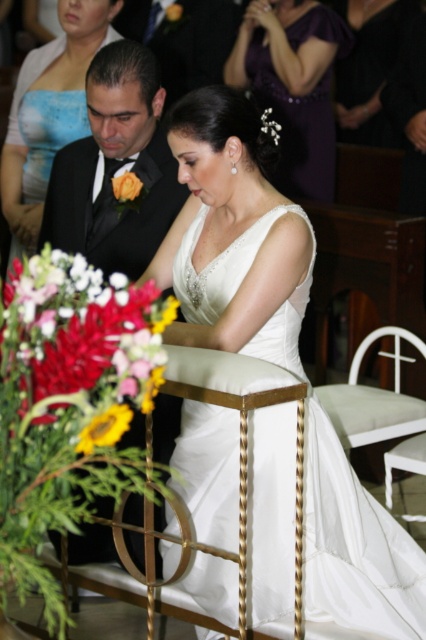
You are a photographer positioned behind the couple and want to capture a closeup shot of both the yellow matte sunflower at lower left and the white matte flower at upper center in the same frame. Given that your camera has a maximum focus range of 3.5 feet, will you be able to achieve this shot?

The distance between the yellow matte sunflower at lower left and the white matte flower at upper center is 3.79 feet, which exceeds the camera maximum focus range of 3.5 feet. Therefore, you cannot capture both in the same closeup shot.

You are a photographer at the wedding ceremony. You need to position yourself so that both the yellow matte sunflower at lower left and the white matte flower at upper center are visible in your shot. Based on their positions, where should you stand relative to the flowers?

You should position yourself below the white matte flower at upper center and above the yellow matte sunflower at lower left to capture both in your shot since the yellow matte sunflower at lower left is located below the white matte flower at upper center.

You are a photographer at a fashion show. You need to decide which dress to feature in the next photo. The satin purple dress at upper center and the matte black dress at center are both in the frame. Based on their sizes, which dress should you focus on to ensure it stands out more?

The satin purple dress at upper center is wider than the matte black dress at center, so focusing on the satin purple dress at upper center would make it stand out more due to its larger size.